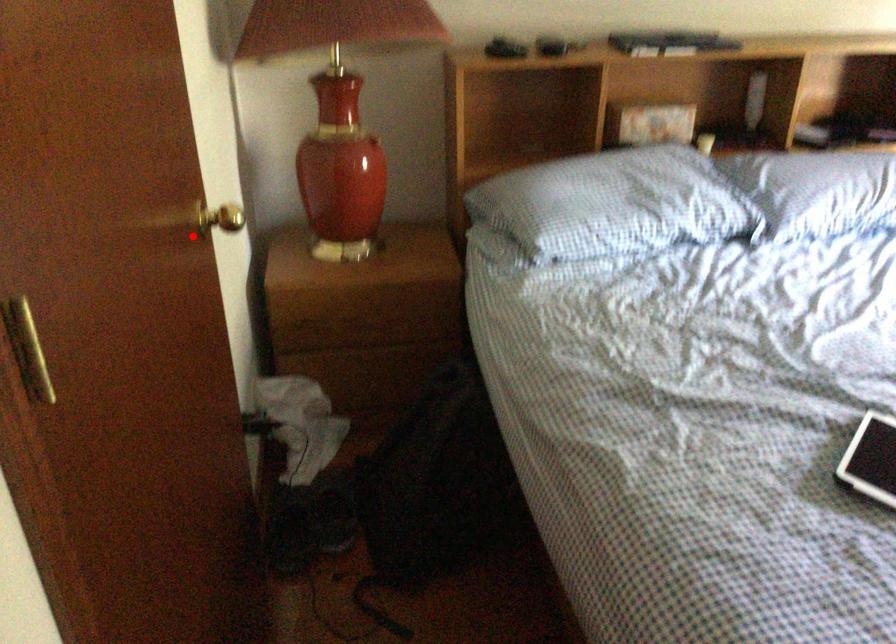
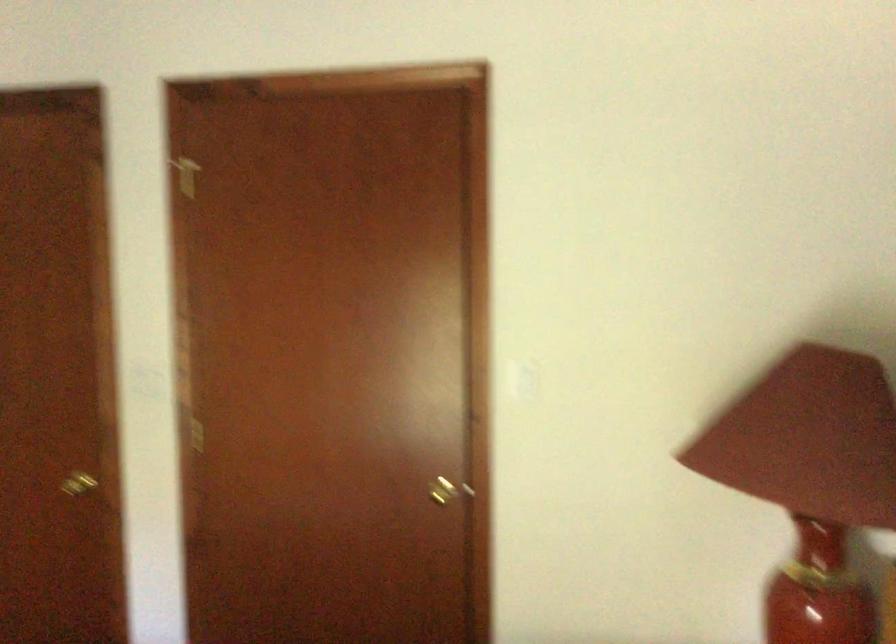
Question: I am providing you with two images of the same scene from different viewpoints. A red point is marked on the first image. At the location where the point appears in image 1, is it still visible in image 2?

Choices:
 (A) Yes
 (B) No

Answer: (A)